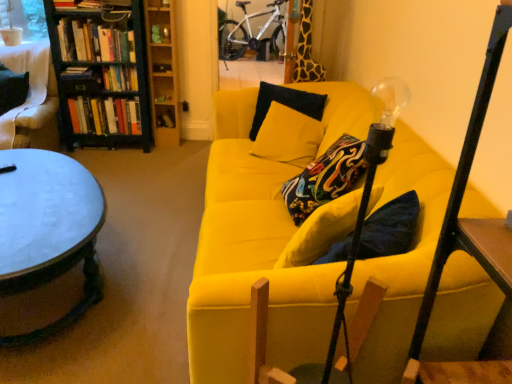
The width and height of the screenshot is (512, 384). What do you see at coordinates (250, 32) in the screenshot?
I see `white matte bicycle at upper center` at bounding box center [250, 32].

Locate an element on the screen. This screenshot has height=384, width=512. white fabric chair at upper left is located at coordinates (31, 99).

What do you see at coordinates (48, 229) in the screenshot?
I see `metallic round table at left` at bounding box center [48, 229].

Locate an element on the screen. metallic round table at left is located at coordinates (48, 229).

This screenshot has height=384, width=512. What do you see at coordinates (94, 42) in the screenshot?
I see `hardcover books at upper left, which is counted as the fifth book, starting from the bottom` at bounding box center [94, 42].

What are the coordinates of `hardcover books at upper left, which is counted as the fifth book, starting from the bottom` in the screenshot? It's located at (94, 42).

I want to click on hardcover books at upper left, the third book ordered from the bottom, so click(x=120, y=78).

This screenshot has height=384, width=512. What do you see at coordinates (105, 115) in the screenshot?
I see `hardcover books at left, marked as the 2th book in a bottom-to-top arrangement` at bounding box center [105, 115].

How much space does hardcover book at center, marked as the fifth book in a top-to-bottom arrangement, occupy horizontally?

hardcover book at center, marked as the fifth book in a top-to-bottom arrangement, is 5.02 inches in width.

Where is `black wood bookcase at left, which is the second bookcase from right to left`? black wood bookcase at left, which is the second bookcase from right to left is located at coordinates (101, 73).

Does hardcover book at center, marked as the fifth book in a top-to-bottom arrangement, have a larger size compared to hardcover books at upper left, the third book ordered from the bottom?

No, hardcover book at center, marked as the fifth book in a top-to-bottom arrangement, is not bigger than hardcover books at upper left, the third book ordered from the bottom.

Considering the relative sizes of hardcover book at center, marked as the fifth book in a top-to-bottom arrangement, and hardcover books at upper left, acting as the third book starting from the top, in the image provided, is hardcover book at center, marked as the fifth book in a top-to-bottom arrangement, wider than hardcover books at upper left, acting as the third book starting from the top,?

In fact, hardcover book at center, marked as the fifth book in a top-to-bottom arrangement, might be narrower than hardcover books at upper left, acting as the third book starting from the top.

Looking at this image, is hardcover book at center, marked as the 1th book in a bottom-to-top arrangement, positioned before hardcover books at upper left, the third book ordered from the bottom?

No, hardcover book at center, marked as the 1th book in a bottom-to-top arrangement, is further to the viewer.

Is point (166, 107) closer to camera compared to point (106, 78)?

No, (166, 107) is behind (106, 78).

From the image's perspective, is hardcover books at upper left, which is counted as the fifth book, starting from the bottom, under hardcover book at upper center, placed as the fourth book when sorted from bottom to top?

Incorrect, from the image's perspective, hardcover books at upper left, which is counted as the fifth book, starting from the bottom, is higher than hardcover book at upper center, placed as the fourth book when sorted from bottom to top.

Looking at this image, is hardcover books at upper left, which is counted as the fifth book, starting from the bottom, positioned with its back to hardcover book at upper center, placed as the fourth book when sorted from bottom to top?

No, hardcover books at upper left, which is counted as the fifth book, starting from the bottom,'s orientation is not away from hardcover book at upper center, placed as the fourth book when sorted from bottom to top.

Is point (73, 41) closer to camera compared to point (156, 64)?

Yes, point (73, 41) is closer to viewer.

Considering the sizes of objects hardcover book at center, marked as the fifth book in a top-to-bottom arrangement, and black wood bookcase at left, which is the second bookcase from right to left, in the image provided, who is smaller, hardcover book at center, marked as the fifth book in a top-to-bottom arrangement, or black wood bookcase at left, which is the second bookcase from right to left,?

hardcover book at center, marked as the fifth book in a top-to-bottom arrangement, is smaller.

Considering the sizes of objects hardcover book at center, marked as the 1th book in a bottom-to-top arrangement, and black wood bookcase at left, which is the second bookcase from right to left, in the image provided, who is wider, hardcover book at center, marked as the 1th book in a bottom-to-top arrangement, or black wood bookcase at left, which is the second bookcase from right to left,?

black wood bookcase at left, which is the second bookcase from right to left, is wider.

Considering the positions of objects hardcover book at center, marked as the 1th book in a bottom-to-top arrangement, and black wood bookcase at left, which is the second bookcase from right to left, in the image provided, who is more to the left, hardcover book at center, marked as the 1th book in a bottom-to-top arrangement, or black wood bookcase at left, which is the second bookcase from right to left,?

black wood bookcase at left, which is the second bookcase from right to left.

Looking at this image, based on their sizes in the image, would you say hardcover books at upper left, the third book ordered from the bottom, is bigger or smaller than black matte pillow at center?

Considering their sizes, hardcover books at upper left, the third book ordered from the bottom, takes up less space than black matte pillow at center.

Which object is closer to the camera, hardcover books at upper left, acting as the third book starting from the top, or black matte pillow at center?

Positioned in front is black matte pillow at center.

How many degrees apart are the facing directions of hardcover books at upper left, the third book ordered from the bottom, and black matte pillow at center?

The facing directions of hardcover books at upper left, the third book ordered from the bottom, and black matte pillow at center are 19.3 degrees apart.

How distant is hardcover books at upper left, acting as the third book starting from the top, from black matte pillow at center?

hardcover books at upper left, acting as the third book starting from the top, and black matte pillow at center are 4.82 feet apart.

In the image, is white matte bicycle at upper center positioned in front of or behind hardcover books at upper left, the third book ordered from the bottom?

white matte bicycle at upper center is behind hardcover books at upper left, the third book ordered from the bottom.

Is white matte bicycle at upper center aimed at hardcover books at upper left, the third book ordered from the bottom?

Yes, white matte bicycle at upper center is oriented towards hardcover books at upper left, the third book ordered from the bottom.

Who is taller, white matte bicycle at upper center or hardcover books at upper left, acting as the third book starting from the top?

With more height is white matte bicycle at upper center.

What's the angular difference between white matte bicycle at upper center and hardcover books at upper left, the third book ordered from the bottom,'s facing directions?

white matte bicycle at upper center and hardcover books at upper left, the third book ordered from the bottom, are facing 1.43 degrees away from each other.

Is metallic round table at left facing away from yellow fabric couch at center?

That's right, metallic round table at left is facing away from yellow fabric couch at center.

Does metallic round table at left have a smaller size compared to yellow fabric couch at center?

Yes, metallic round table at left is smaller than yellow fabric couch at center.

From a real-world perspective, between metallic round table at left and yellow fabric couch at center, who is vertically higher?

yellow fabric couch at center is physically above.

Considering the positions of points (138, 97) and (22, 61), is point (138, 97) closer to camera compared to point (22, 61)?

No, it is behind (22, 61).

Is black wood bookcase at left, the first bookcase when ordered from left to right, not inside white fabric chair at upper left?

That's correct, black wood bookcase at left, the first bookcase when ordered from left to right, is outside of white fabric chair at upper left.

From the image's perspective, is black wood bookcase at left, the first bookcase when ordered from left to right, above or below white fabric chair at upper left?

Based on their image positions, black wood bookcase at left, the first bookcase when ordered from left to right, is located above white fabric chair at upper left.

How distant is black wood bookcase at left, which is the second bookcase from right to left, from white fabric chair at upper left?

black wood bookcase at left, which is the second bookcase from right to left, and white fabric chair at upper left are 15.13 inches apart.

This screenshot has width=512, height=384. I want to click on the 3rd book in front when counting from the hardcover book at center, marked as the 1th book in a bottom-to-top arrangement, so pyautogui.click(x=120, y=78).

Find the location of a particular element. This screenshot has width=512, height=384. book that is the 2nd object to the left of the hardcover book at upper center, which appears as the 2th book when viewed from the top, starting at the anchor is located at coordinates (94, 42).

Considering their positions, is hardcover books at left, which appears as the 4th book when viewed from the top, positioned further to wooden bookcase at upper center, the 2th bookcase when ordered from left to right, than hardcover book at upper center, which appears as the 2th book when viewed from the top?

Based on the image, hardcover books at left, which appears as the 4th book when viewed from the top, appears to be further to wooden bookcase at upper center, the 2th bookcase when ordered from left to right.

Considering their positions, is hardcover books at upper left, which is counted as the first book, starting from the top, positioned closer to black wood bookcase at left, the first bookcase when ordered from left to right, than hardcover books at upper left, the third book ordered from the bottom?

hardcover books at upper left, which is counted as the first book, starting from the top, lies closer to black wood bookcase at left, the first bookcase when ordered from left to right, than the other object.

Considering their positions, is hardcover book at upper center, placed as the fourth book when sorted from bottom to top, positioned further to white fabric chair at upper left than hardcover books at left, which appears as the 4th book when viewed from the top?

Based on the image, hardcover book at upper center, placed as the fourth book when sorted from bottom to top, appears to be further to white fabric chair at upper left.

Looking at the image, which one is located closer to black matte pillow at center, hardcover books at upper left, which is counted as the first book, starting from the top, or white matte bicycle at upper center?

white matte bicycle at upper center is positioned closer to the anchor black matte pillow at center.

Considering their positions, is hardcover books at upper left, which is counted as the fifth book, starting from the bottom, positioned further to white fabric chair at upper left than yellow fabric couch at center?

The object further to white fabric chair at upper left is yellow fabric couch at center.

Consider the image. From the image, which object appears to be nearer to hardcover books at upper left, which is counted as the fifth book, starting from the bottom, hardcover books at upper left, the third book ordered from the bottom, or hardcover book at center, marked as the 1th book in a bottom-to-top arrangement?

hardcover books at upper left, the third book ordered from the bottom, lies closer to hardcover books at upper left, which is counted as the fifth book, starting from the bottom, than the other object.

From the image, which object appears to be farther from white fabric chair at upper left, white matte bicycle at upper center or hardcover books at upper left, acting as the third book starting from the top?

Based on the image, white matte bicycle at upper center appears to be further to white fabric chair at upper left.

Considering their positions, is black matte pillow at center positioned further to hardcover book at upper center, placed as the fourth book when sorted from bottom to top, than yellow fabric couch at center?

yellow fabric couch at center lies further to hardcover book at upper center, placed as the fourth book when sorted from bottom to top, than the other object.

Locate an element on the screen. bookcase located between metallic round table at left and hardcover books at upper left, which is counted as the first book, starting from the top, in the depth direction is located at coordinates (101, 73).

Where is `coffee table positioned between yellow fabric couch at center and hardcover books at upper left, which is counted as the first book, starting from the top, from near to far`? The width and height of the screenshot is (512, 384). coffee table positioned between yellow fabric couch at center and hardcover books at upper left, which is counted as the first book, starting from the top, from near to far is located at coordinates (48, 229).

Locate an element on the screen. The width and height of the screenshot is (512, 384). bookcase situated between black wood bookcase at left, the first bookcase when ordered from left to right, and black matte pillow at center from left to right is located at coordinates (162, 73).

Image resolution: width=512 pixels, height=384 pixels. Find the location of `book between yellow fabric couch at center and wooden bookcase at upper center, the 2th bookcase when ordered from left to right, from front to back`. book between yellow fabric couch at center and wooden bookcase at upper center, the 2th bookcase when ordered from left to right, from front to back is located at coordinates (94, 42).